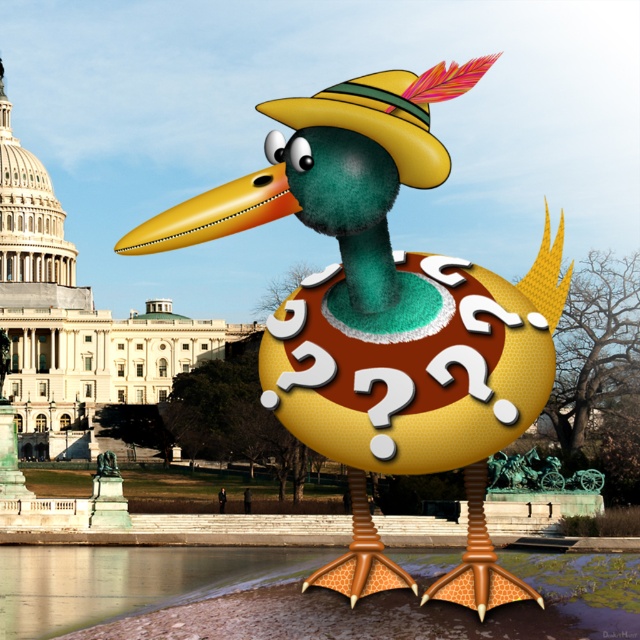
In the image, there is a matte yellow duck at center and a brushed metal statue at center. From the perspective of an observer looking at the scene, which object is positioned to the left?

The brushed metal statue at center is positioned to the left of the matte yellow duck at center.

You are an artist trying to draw the scene accurately. You notice two objects at the center of the image. Which one is wider, the matte yellow duck at center or the brushed metal statue at center?

The matte yellow duck at center is wider than the brushed metal statue at center according to the description.

You are a photographer standing in front of the matte yellow duck at center and the brushed metal statue at center. You want to take a photo that includes both objects in the frame. Which object should you position closer to the camera to ensure both are visible?

The matte yellow duck at center is located above the brushed metal statue at center. To include both in the frame, position the matte yellow duck at center closer to the camera so that its lower part aligns with the statue, ensuring both are visible.